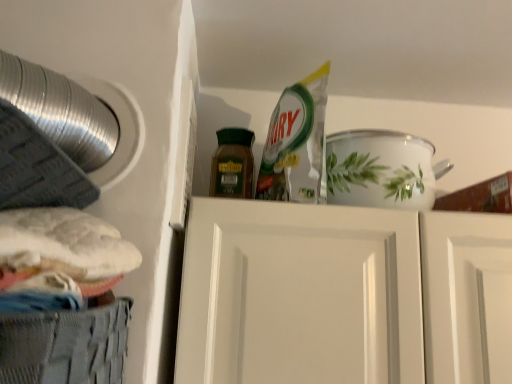
Question: Can you confirm if brown matte jar at center is positioned to the right of gray mesh basket at lower left?

Choices:
 (A) yes
 (B) no

Answer: (A)

Question: From a real-world perspective, is brown matte jar at center physically below gray mesh basket at lower left?

Choices:
 (A) no
 (B) yes

Answer: (A)

Question: Considering the relative sizes of brown matte jar at center and gray mesh basket at lower left in the image provided, is brown matte jar at center thinner than gray mesh basket at lower left?

Choices:
 (A) no
 (B) yes

Answer: (B)

Question: Is brown matte jar at center at the left side of gray mesh basket at lower left?

Choices:
 (A) yes
 (B) no

Answer: (B)

Question: Considering the relative sizes of brown matte jar at center and gray mesh basket at lower left in the image provided, is brown matte jar at center taller than gray mesh basket at lower left?

Choices:
 (A) no
 (B) yes

Answer: (B)

Question: From a real-world perspective, does brown matte jar at center stand above gray mesh basket at lower left?

Choices:
 (A) yes
 (B) no

Answer: (A)

Question: From a real-world perspective, is gray mesh basket at lower left physically above brown matte jar at center?

Choices:
 (A) no
 (B) yes

Answer: (A)

Question: From the image's perspective, does gray mesh basket at lower left appear higher than brown matte jar at center?

Choices:
 (A) no
 (B) yes

Answer: (A)

Question: Can you confirm if gray mesh basket at lower left is thinner than brown matte jar at center?

Choices:
 (A) no
 (B) yes

Answer: (A)

Question: Is brown matte jar at center completely or partially inside gray mesh basket at lower left?

Choices:
 (A) yes
 (B) no

Answer: (B)

Question: Is gray mesh basket at lower left at the left side of brown matte jar at center?

Choices:
 (A) yes
 (B) no

Answer: (A)

Question: Can you confirm if gray mesh basket at lower left is smaller than brown matte jar at center?

Choices:
 (A) yes
 (B) no

Answer: (B)

Question: Can you confirm if brown matte jar at center is thinner than white glossy door at center?

Choices:
 (A) no
 (B) yes

Answer: (B)